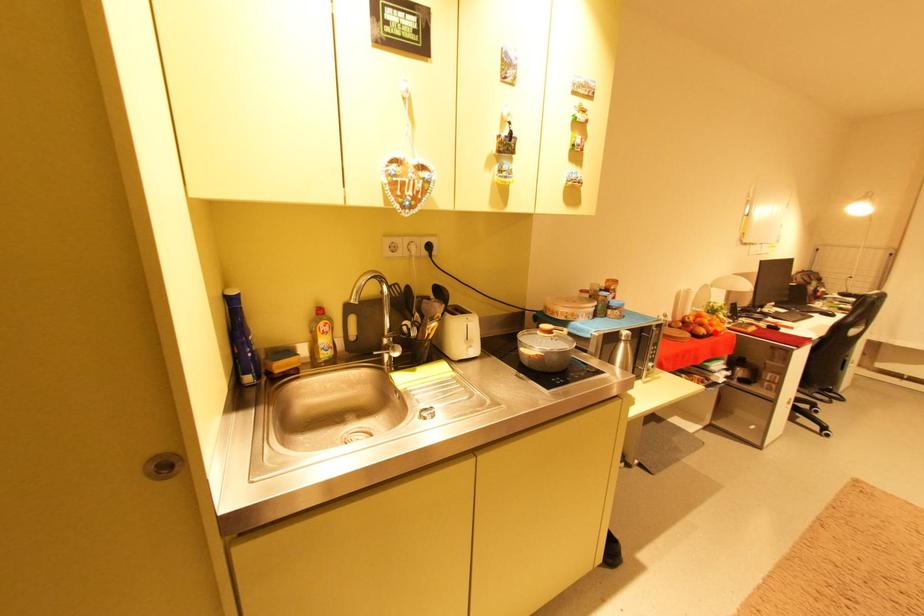
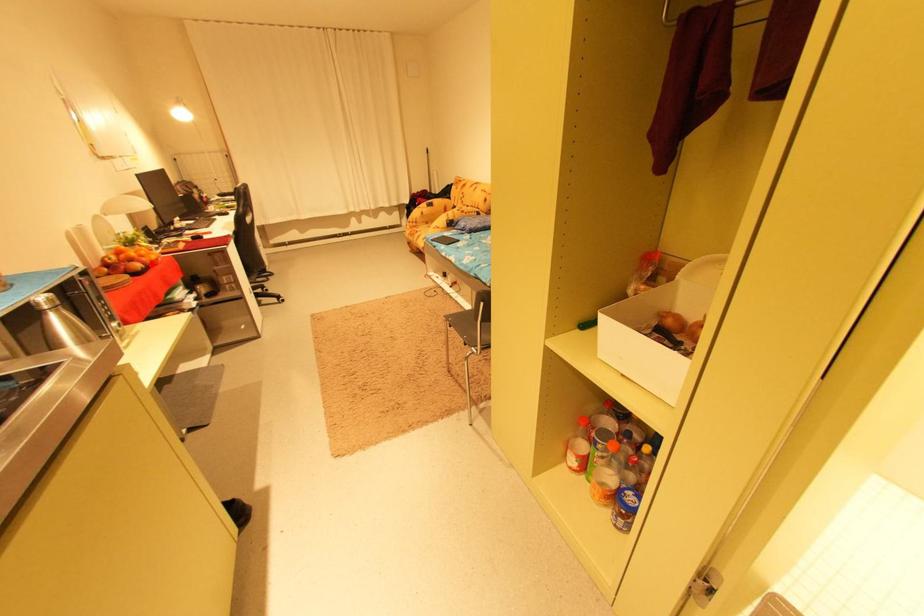
I am providing you with two images of the same scene from different viewpoints. A red point is marked on the first image and another point is marked on the second image. Does the point marked in image1 correspond to the same location as the one in image2?

Yes